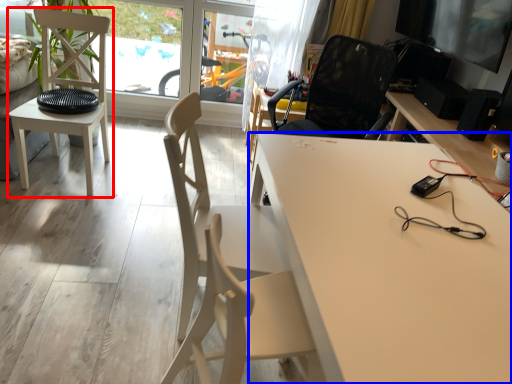
Question: Which point is further to the camera, chair (highlighted by a red box) or desk (highlighted by a blue box)?

Choices:
 (A) chair
 (B) desk

Answer: (A)